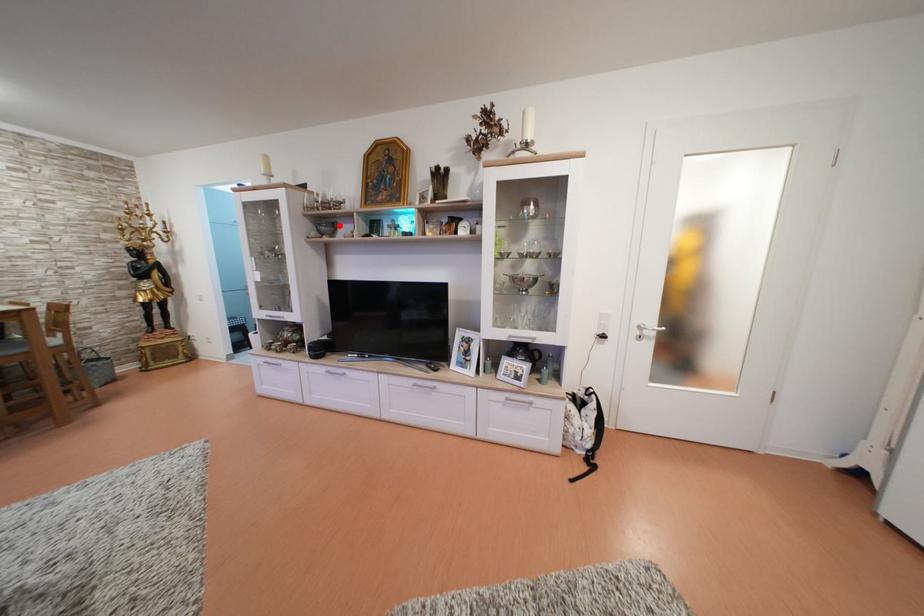
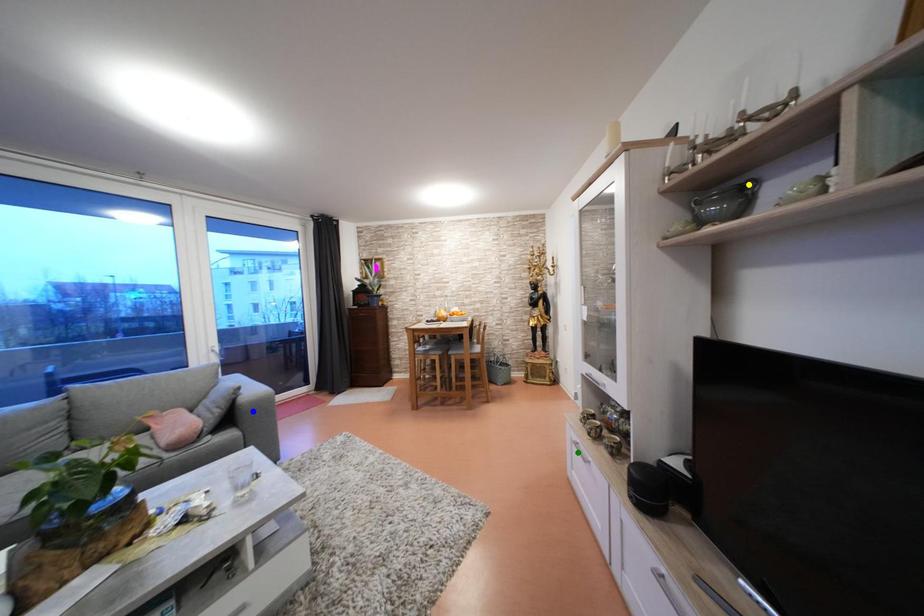
Question: I am providing you with two images of the same scene from different viewpoints. A red point is marked on the first image. You are given multiple points on the second image. Which point in image 2 is actually the same real-world point as the red point in image 1?

Choices:
 (A) blue point
 (B) yellow point
 (C) green point

Answer: (B)